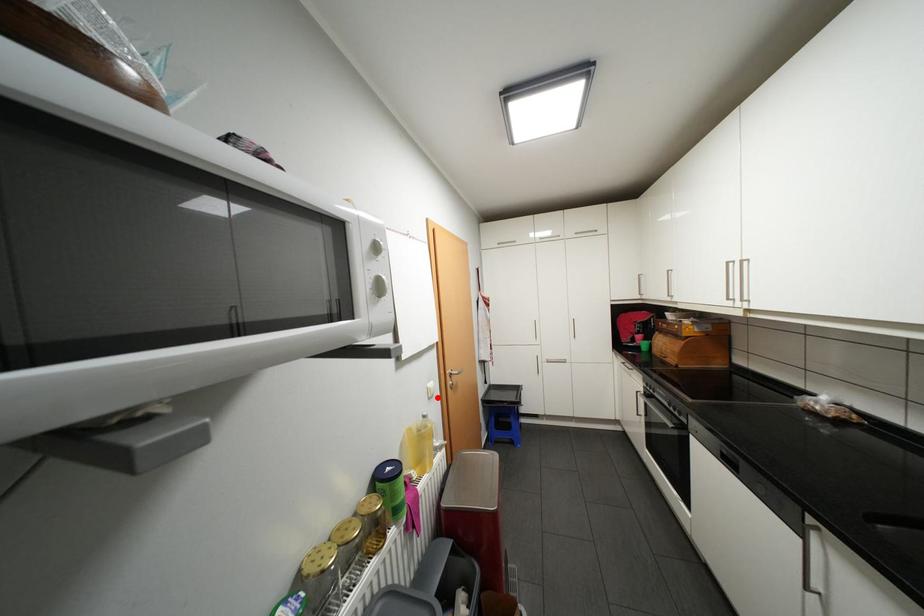
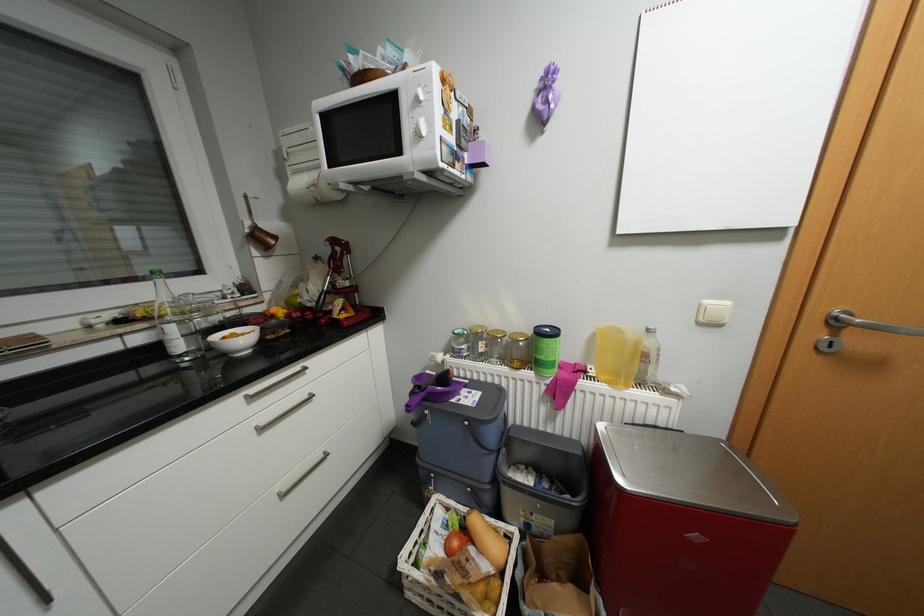
Find the pixel in the second image that matches the highlighted location in the first image.

(708, 323)